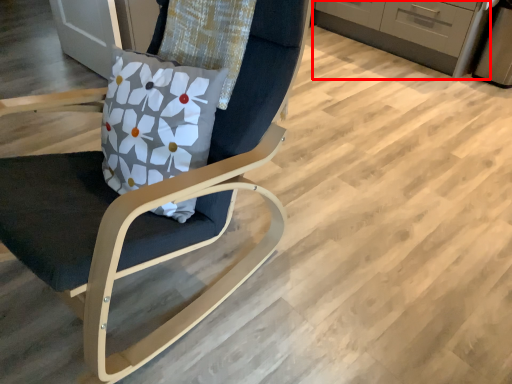
Question: In this image, where is cabinetry (annotated by the red box) located relative to chair?

Choices:
 (A) right
 (B) left

Answer: (A)